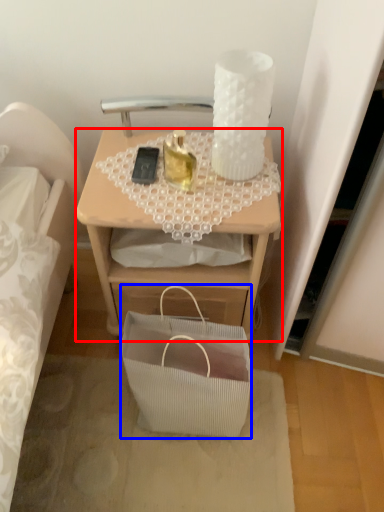
Question: Among these objects, which one is nearest to the camera, desk (highlighted by a red box) or handbag (highlighted by a blue box)?

Choices:
 (A) desk
 (B) handbag

Answer: (B)